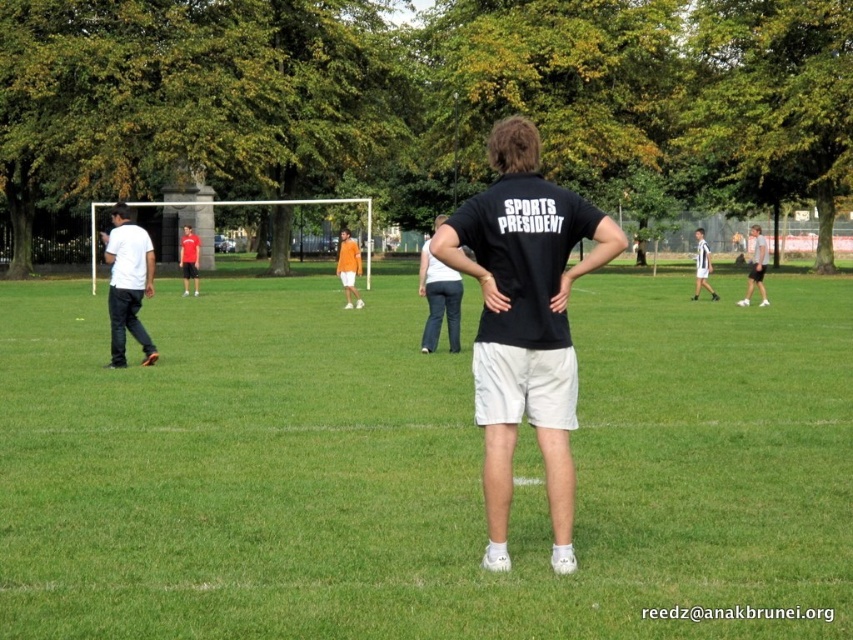
Question: Which is farther from the green grass at center?

Choices:
 (A) matte red shirt at center
 (B) white jersey at center
 (C) black matte t-shirt at center
 (D) denim jeans at center

Answer: (A)

Question: Is black matte t-shirt at center above orange fabric shorts at center?

Choices:
 (A) yes
 (B) no

Answer: (B)

Question: Can you confirm if matte red shirt at center is thinner than white jersey at center?

Choices:
 (A) yes
 (B) no

Answer: (A)

Question: Is the position of denim jeans at center more distant than that of orange fabric shorts at center?

Choices:
 (A) yes
 (B) no

Answer: (B)

Question: Which of the following is the farthest from the observer?

Choices:
 (A) (196, 248)
 (B) (747, 289)
 (C) (440, 288)

Answer: (A)

Question: Estimate the real-world distances between objects in this image. Which object is farther from the white matte shirt at left?

Choices:
 (A) black matte t-shirt at center
 (B) matte red shirt at center

Answer: (B)